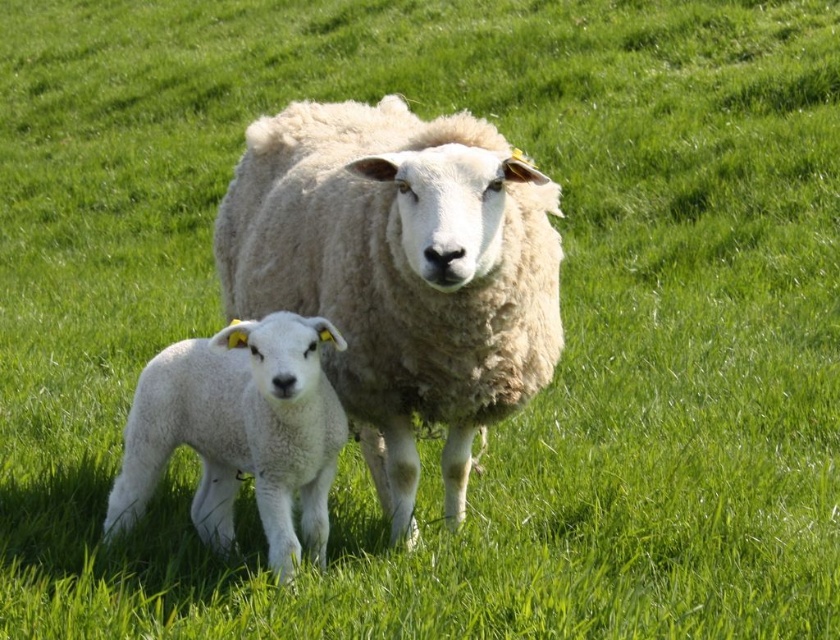
You are a farmer who wants to separate the white woolen sheep at center and the white woolen lamb at lower left into two pens based on their sizes. Which pen should the larger animal go into?

The white woolen sheep at center is larger than the white woolen lamb at lower left, so the larger animal should go into the pen designated for adult sheep.

You are a photographer trying to capture a closeup of the two sheep in the image. You are currently standing at point A, which is located at point [476,397]. There is an obstacle at point B, located at point [203,406]. Which point should you move to in order to get a clearer shot of the sheep without the obstacle blocking your view?

You should move to point A at [476,397] because it is closer to the camera than point B at [203,406], so moving there would allow you to capture a clearer shot of the sheep without the obstacle at point B blocking your view.

In the scene shown: You are a farmer observing the field. You notice the white woolen sheep at center and the white woolen lamb at lower left. Which of these two animals is positioned higher in the image?

The white woolen sheep at center is positioned higher in the image than the white woolen lamb at lower left.